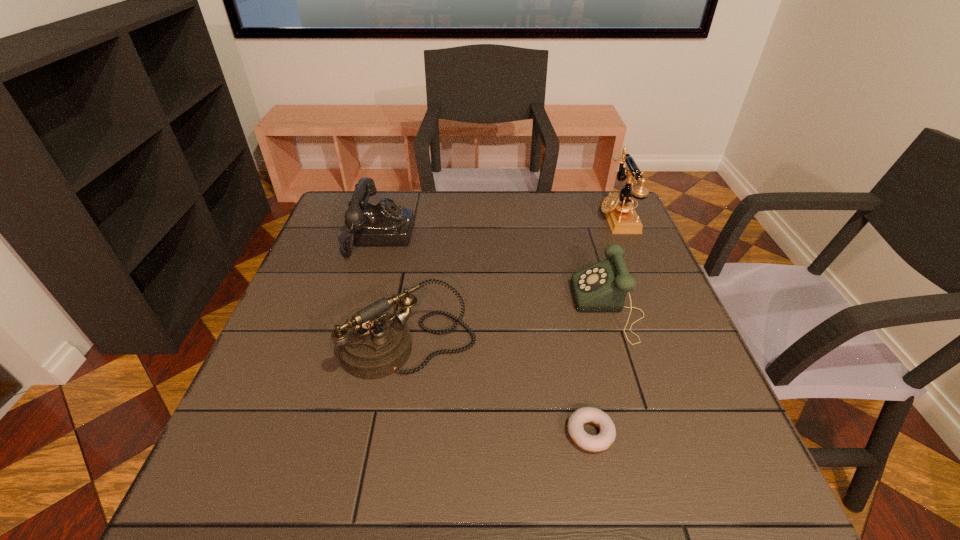
At what (x,y) coordinates should I click in order to perform the action: click on free region at the far edge of the desktop. Please return your answer as a coordinate pair (x, y). The height and width of the screenshot is (540, 960). Looking at the image, I should click on (503, 208).

The image size is (960, 540). In order to click on vacant space at the near edge in this screenshot , I will do `click(448, 492)`.

In the image, there is a desktop. Where is `vacant space at the right edge`? vacant space at the right edge is located at coordinates (593, 252).

Identify the location of vacant point at the far left corner. (328, 227).

At what (x,y) coordinates should I click in order to perform the action: click on vacant point located between the shortest telephone and the nearest object. Please return your answer as a coordinate pair (x, y). This screenshot has width=960, height=540. Looking at the image, I should click on (599, 370).

Select which object appears as the second closest to the shortest object. Please provide its 2D coordinates. Your answer should be formatted as a tuple, i.e. [(x, y)], where the tuple contains the x and y coordinates of a point satisfying the conditions above.

[(373, 344)]

Identify which object is the fourth closest to the shortest object. Please provide its 2D coordinates. Your answer should be formatted as a tuple, i.e. [(x, y)], where the tuple contains the x and y coordinates of a point satisfying the conditions above.

[(383, 224)]

The image size is (960, 540). I want to click on the third closest telephone to the shortest telephone, so click(383, 224).

Locate an element on the screen. The width and height of the screenshot is (960, 540). telephone that stands as the closest to the shortest object is located at coordinates (602, 287).